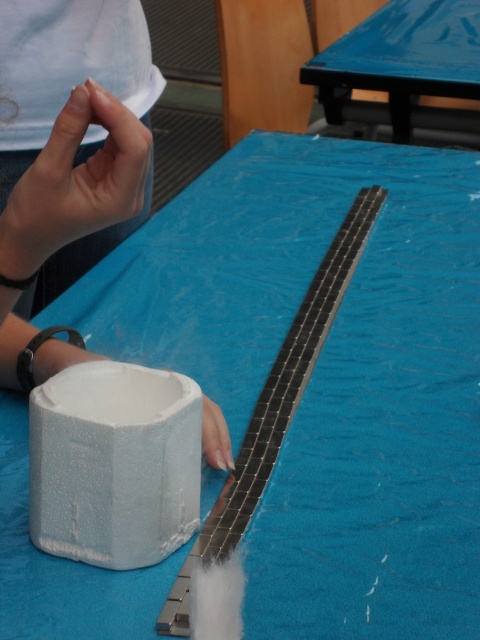
Question: Is white matte foam cup at lower left in front of blue plastic table at upper center?

Choices:
 (A) no
 (B) yes

Answer: (B)

Question: Which of the following is the farthest from the observer?

Choices:
 (A) white matte foam cup at lower left
 (B) blue plastic table at upper center

Answer: (B)

Question: From the image, what is the correct spatial relationship of white matte foam cup at lower left in relation to blue plastic table at upper center?

Choices:
 (A) above
 (B) below

Answer: (B)

Question: Can you confirm if white matte foam cup at lower left is positioned below blue plastic table at upper center?

Choices:
 (A) yes
 (B) no

Answer: (A)

Question: Which object appears farthest from the camera in this image?

Choices:
 (A) white matte foam cup at lower left
 (B) blue plastic table at upper center

Answer: (B)